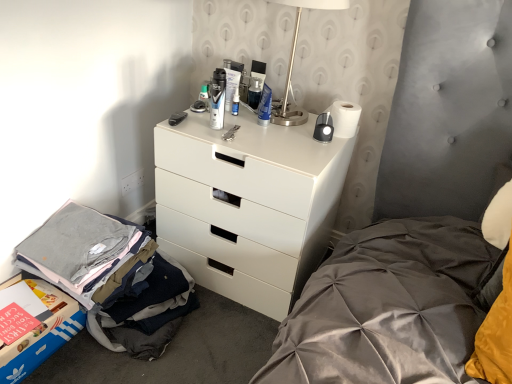
Where is `vacant space that's between matte black shaving cream can at center, marked as the second toiletry in a left-to-right arrangement, and matte plastic tube at upper center, marked as the 3th toiletry in a right-to-left arrangement`? vacant space that's between matte black shaving cream can at center, marked as the second toiletry in a left-to-right arrangement, and matte plastic tube at upper center, marked as the 3th toiletry in a right-to-left arrangement is located at coordinates (217, 120).